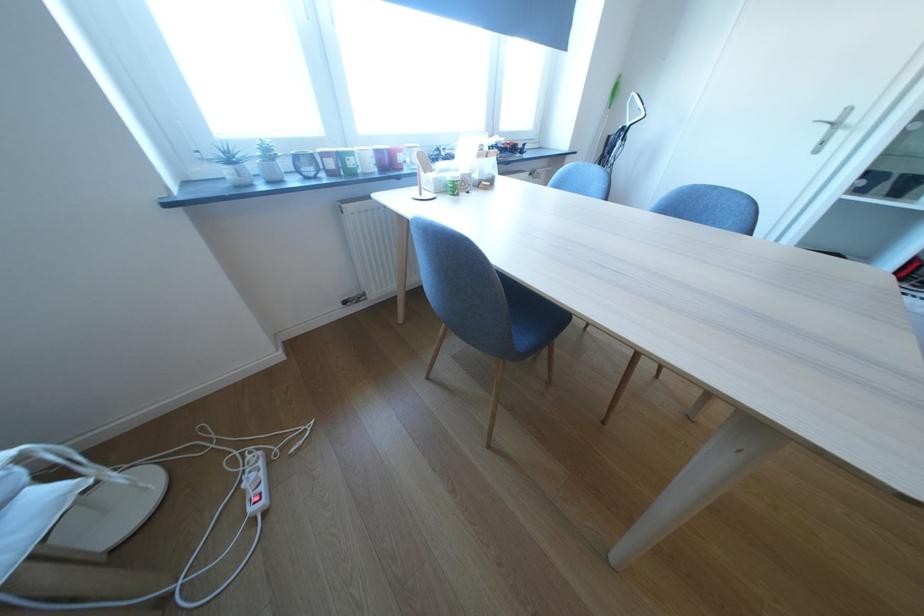
What do you see at coordinates (536, 318) in the screenshot? Image resolution: width=924 pixels, height=616 pixels. I see `the blue chair sitting surface` at bounding box center [536, 318].